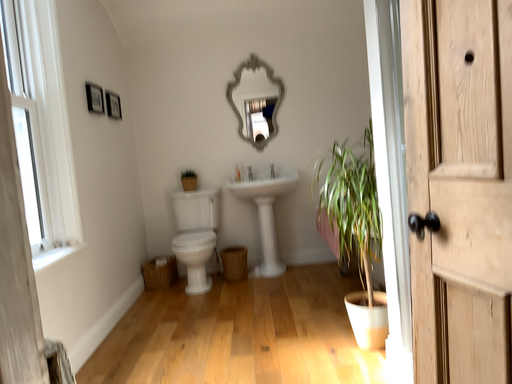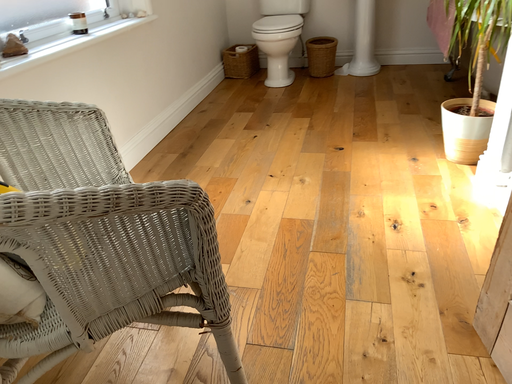
Question: How did the camera likely rotate when shooting the video?

Choices:
 (A) rotated downward
 (B) rotated upward

Answer: (A)